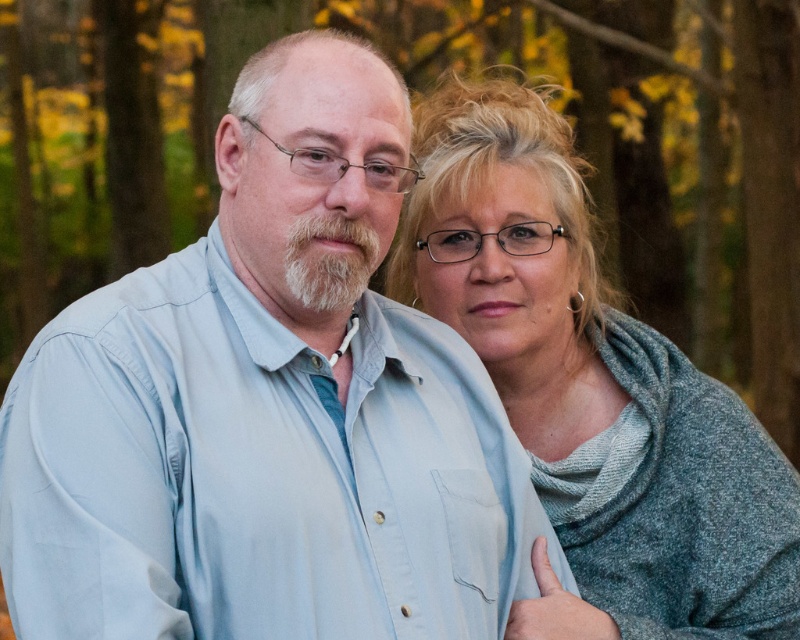
In the scene shown: Between light blue shirt at center and gray knit sweater at upper right, which one has more height?

Standing taller between the two is gray knit sweater at upper right.

Does light blue shirt at center have a lesser height compared to gray knit sweater at upper right?

Correct, light blue shirt at center is not as tall as gray knit sweater at upper right.

Which is in front, point (50, 497) or point (716, 481)?

Positioned in front is point (50, 497).

At what (x,y) coordinates should I click in order to perform the action: click on light blue shirt at center. Please return your answer as a coordinate pair (x, y). Looking at the image, I should click on (266, 413).

Who is positioned more to the right, gray knit sweater at upper right or white fluffy beard at center?

Positioned to the right is gray knit sweater at upper right.

Who is more distant from viewer, (572,260) or (318,225)?

Point (572,260)

Locate an element on the screen. gray knit sweater at upper right is located at coordinates (594, 390).

Between light blue shirt at center and white fluffy beard at center, which one appears on the left side from the viewer's perspective?

From the viewer's perspective, light blue shirt at center appears more on the left side.

Does point (393, 506) come closer to viewer compared to point (352, 273)?

Yes, point (393, 506) is in front of point (352, 273).

In order to click on light blue shirt at center in this screenshot , I will do `click(266, 413)`.